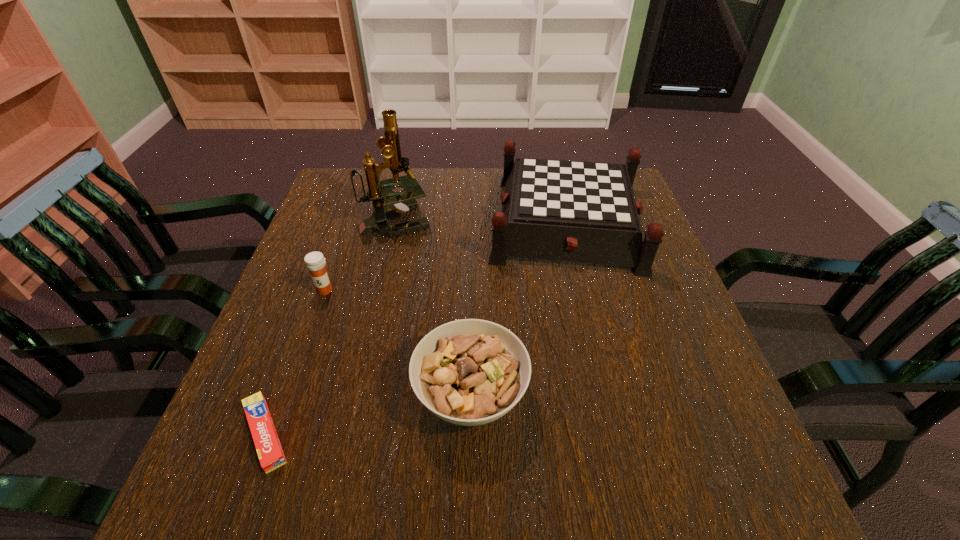
Where is `vacant area between the third nearest object and the fourth shortest object`? This screenshot has height=540, width=960. vacant area between the third nearest object and the fourth shortest object is located at coordinates (446, 256).

Find the location of a particular element. The height and width of the screenshot is (540, 960). vacant space that is in between the checkerboard and the toothpaste is located at coordinates (417, 328).

Locate an element on the screen. This screenshot has width=960, height=540. vacant area that lies between the tallest object and the medicine is located at coordinates (360, 255).

Find the location of a particular element. blank region between the third nearest object and the checkerboard is located at coordinates (446, 256).

This screenshot has height=540, width=960. Find the location of `free point between the third farthest object and the shortest object`. free point between the third farthest object and the shortest object is located at coordinates (296, 362).

Choose which object is the fourth nearest neighbor to the third nearest object. Please provide its 2D coordinates. Your answer should be formatted as a tuple, i.e. [(x, y)], where the tuple contains the x and y coordinates of a point satisfying the conditions above.

[(573, 211)]

This screenshot has width=960, height=540. I want to click on object that stands as the fourth closest to the stew, so click(400, 202).

Image resolution: width=960 pixels, height=540 pixels. I want to click on vacant space that satisfies the following two spatial constraints: 1. on the label side of the stew; 2. on the left side of the medicine, so click(x=288, y=394).

Find the location of a particular element. free location that satisfies the following two spatial constraints: 1. at the eyepiece of the checkerboard; 2. on the right side of the microscope is located at coordinates (395, 222).

This screenshot has height=540, width=960. Identify the location of vacant space that satisfies the following two spatial constraints: 1. at the eyepiece of the tallest object; 2. on the left side of the stew. (355, 394).